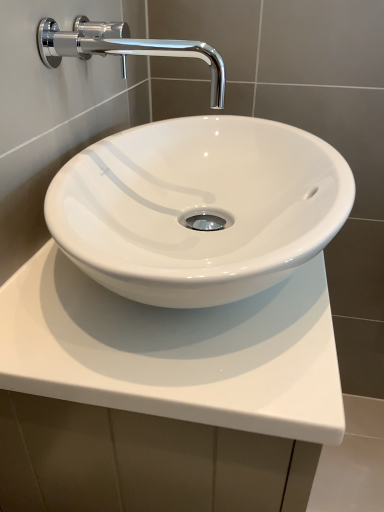
The width and height of the screenshot is (384, 512). Describe the element at coordinates (176, 351) in the screenshot. I see `white glossy countertop at center` at that location.

You are a GUI agent. You are given a task and a screenshot of the screen. Output one action in this format:
    pyautogui.click(x=<x>, y=<y>)
    Task: Click on the white glossy countertop at center
    
    Given the screenshot: What is the action you would take?
    pyautogui.click(x=176, y=351)

What is the approximate height of chrome/metallic faucet at upper left?

The height of chrome/metallic faucet at upper left is 3.28 inches.

Measure the distance between point (142, 45) and camera.

They are 67.00 centimeters apart.

What do you see at coordinates (123, 48) in the screenshot? I see `chrome/metallic faucet at upper left` at bounding box center [123, 48].

You are a GUI agent. You are given a task and a screenshot of the screen. Output one action in this format:
    pyautogui.click(x=<x>, y=<y>)
    Task: Click on the chrome/metallic faucet at upper left
    This screenshot has width=384, height=512.
    Given the screenshot: What is the action you would take?
    pyautogui.click(x=123, y=48)

This screenshot has height=512, width=384. What are the coordinates of `white glossy countertop at center` in the screenshot? It's located at (176, 351).

Does white glossy countertop at center appear on the left side of chrome/metallic faucet at upper left?

No.

Is white glossy countertop at center positioned before chrome/metallic faucet at upper left?

Yes, it is.

Which is closer to the camera, (248, 375) or (202, 44)?

The point (248, 375) is closer.

From the image's perspective, between white glossy countertop at center and chrome/metallic faucet at upper left, who is located below?

white glossy countertop at center is shown below in the image.

Based on the photo, from a real-world perspective, which is physically above, white glossy countertop at center or chrome/metallic faucet at upper left?

chrome/metallic faucet at upper left.

Which object is wider, white glossy countertop at center or chrome/metallic faucet at upper left?

white glossy countertop at center.

Is white glossy countertop at center taller or shorter than chrome/metallic faucet at upper left?

In the image, white glossy countertop at center appears to be taller than chrome/metallic faucet at upper left.

Between white glossy countertop at center and chrome/metallic faucet at upper left, which one has smaller size?

chrome/metallic faucet at upper left is smaller.

Is white glossy countertop at center outside of chrome/metallic faucet at upper left?

Yes, white glossy countertop at center is outside of chrome/metallic faucet at upper left.

Are white glossy countertop at center and chrome/metallic faucet at upper left located far from each other?

Actually, white glossy countertop at center and chrome/metallic faucet at upper left are a little close together.

Based on the photo, is white glossy countertop at center facing away from chrome/metallic faucet at upper left?

white glossy countertop at center is not turned away from chrome/metallic faucet at upper left.

Can you tell me how much white glossy countertop at center and chrome/metallic faucet at upper left differ in facing direction?

1.81 degrees.

Identify the location of tap above the white glossy countertop at center (from a real-world perspective). tap(123, 48).

Can you confirm if chrome/metallic faucet at upper left is positioned to the right of white glossy countertop at center?

No.

Which is behind, chrome/metallic faucet at upper left or white glossy countertop at center?

Positioned behind is chrome/metallic faucet at upper left.

Is point (110, 32) less distant than point (212, 347)?

No, it is behind (212, 347).

From the image's perspective, is chrome/metallic faucet at upper left located above or below white glossy countertop at center?

chrome/metallic faucet at upper left is situated higher than white glossy countertop at center in the image.

From a real-world perspective, is chrome/metallic faucet at upper left physically below white glossy countertop at center?

No, from a real-world perspective, chrome/metallic faucet at upper left is not below white glossy countertop at center.

Which of these two, chrome/metallic faucet at upper left or white glossy countertop at center, is thinner?

Thinner between the two is chrome/metallic faucet at upper left.

Between chrome/metallic faucet at upper left and white glossy countertop at center, which one has less height?

With less height is chrome/metallic faucet at upper left.

Is chrome/metallic faucet at upper left smaller than white glossy countertop at center?

Correct, chrome/metallic faucet at upper left occupies less space than white glossy countertop at center.

Is chrome/metallic faucet at upper left spatially inside white glossy countertop at center, or outside of it?

chrome/metallic faucet at upper left is outside white glossy countertop at center.

Does chrome/metallic faucet at upper left touch white glossy countertop at center?

They are not placed beside each other.

From the picture: Could you tell me if chrome/metallic faucet at upper left is facing white glossy countertop at center?

No, chrome/metallic faucet at upper left is not oriented towards white glossy countertop at center.

How different are the orientations of chrome/metallic faucet at upper left and white glossy countertop at center in degrees?

They differ by 1.81 degrees in their facing directions.

Where is `tap that appears behind the white glossy countertop at center`? tap that appears behind the white glossy countertop at center is located at coordinates (123, 48).

Identify the location of tap behind the white glossy countertop at center. (123, 48).

Locate an element on the screen. tap above the white glossy countertop at center (from the image's perspective) is located at coordinates point(123,48).